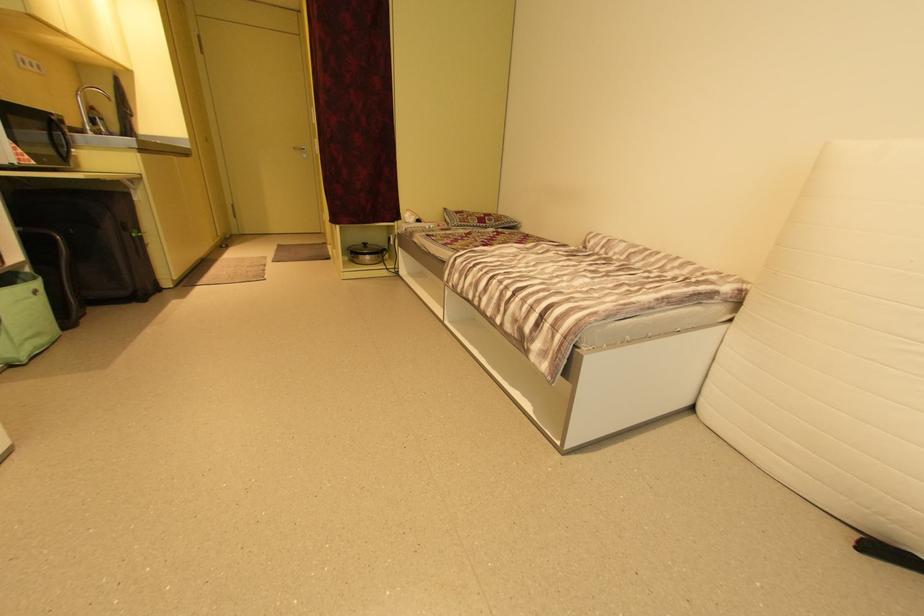
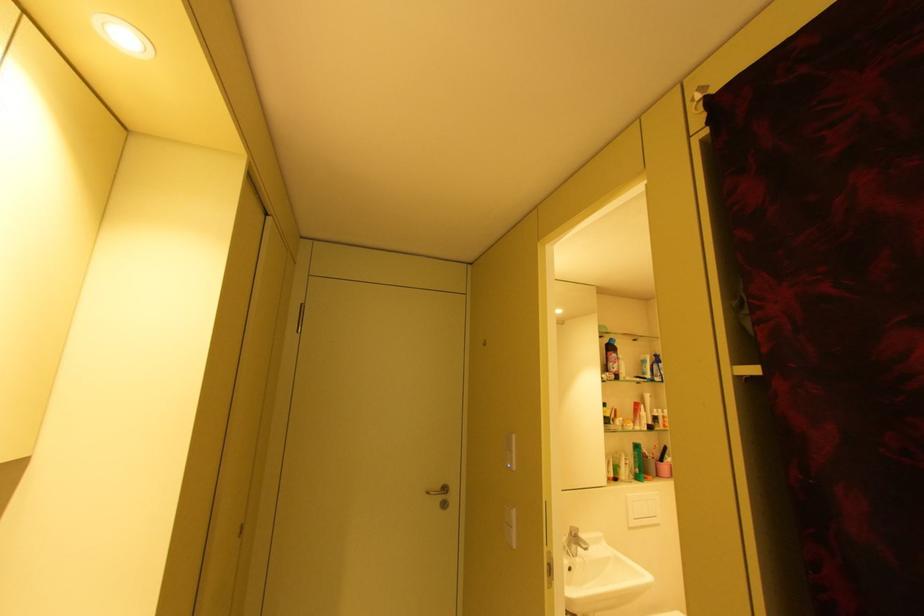
Locate, in the second image, the point that corresponds to (x=300, y=148) in the first image.

(434, 493)